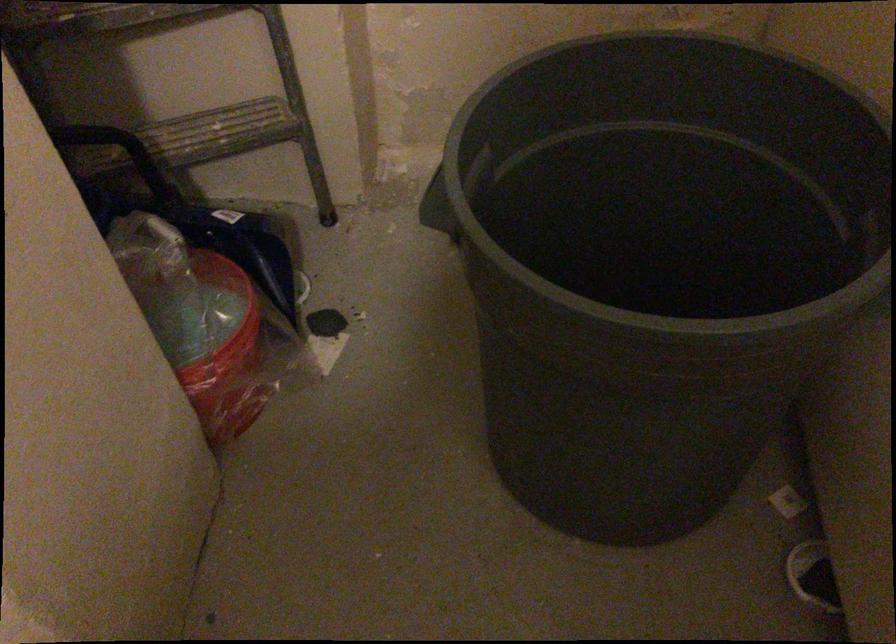
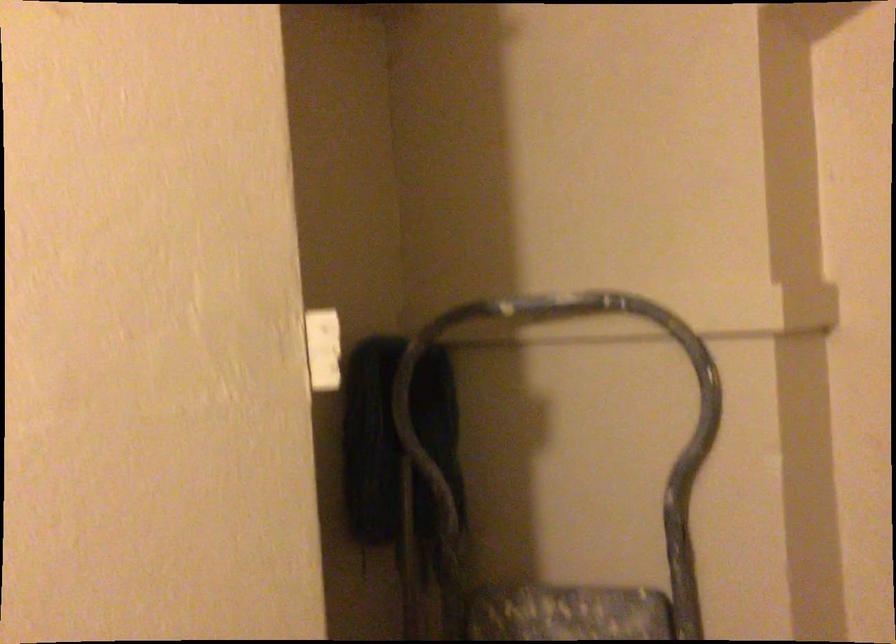
The images are taken continuously from a first-person perspective. In which direction is your viewpoint rotating?

The camera rotated toward left-up.